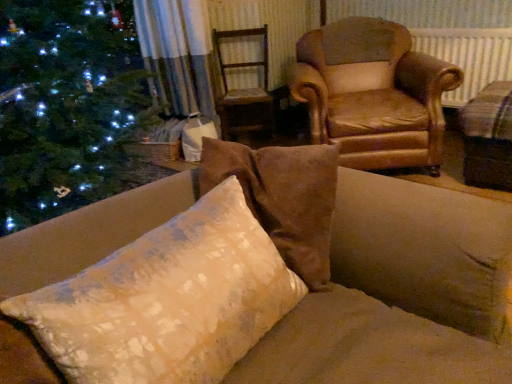
Locate an element on the screen. beige fabric cushion at right is located at coordinates (488, 137).

Which of these two, white plastic radiator at upper right or textured cream pillow at center, is smaller?

With smaller size is white plastic radiator at upper right.

Relative to textured cream pillow at center, is white plastic radiator at upper right in front or behind?

white plastic radiator at upper right is behind textured cream pillow at center.

From the picture: From the image's perspective, is white plastic radiator at upper right located above textured cream pillow at center?

Indeed, from the image's perspective, white plastic radiator at upper right is shown above textured cream pillow at center.

Who is bigger, white plastic radiator at upper right or leather armchair at upper right?

With larger size is leather armchair at upper right.

Measure the distance between white plastic radiator at upper right and leather armchair at upper right.

19.35 inches.

Considering the points (475, 39) and (345, 110), which point is in front, point (475, 39) or point (345, 110)?

Positioned in front is point (345, 110).

Is white plastic radiator at upper right with leather armchair at upper right?

No, white plastic radiator at upper right is not making contact with leather armchair at upper right.

How many degrees apart are the facing directions of wooden swivel chair at center and white plastic radiator at upper right?

41.5 degrees separate the facing orientations of wooden swivel chair at center and white plastic radiator at upper right.

Is wooden swivel chair at center taller than white plastic radiator at upper right?

Yes.

Considering the sizes of wooden swivel chair at center and white plastic radiator at upper right in the image, is wooden swivel chair at center wider or thinner than white plastic radiator at upper right?

Clearly, wooden swivel chair at center has more width compared to white plastic radiator at upper right.

From a real-world perspective, between wooden swivel chair at center and white plastic radiator at upper right, who is vertically higher?

From a 3D spatial view, white plastic radiator at upper right is above.

Does point (389, 109) lie in front of point (159, 313)?

No.

Is leather armchair at upper right positioned with its back to textured cream pillow at center?

leather armchair at upper right does not have its back to textured cream pillow at center.

What's the angular difference between leather armchair at upper right and textured cream pillow at center's facing directions?

The facing directions of leather armchair at upper right and textured cream pillow at center are 54.3 degrees apart.

Does leather armchair at upper right have a larger size compared to textured cream pillow at center?

Correct, leather armchair at upper right is larger in size than textured cream pillow at center.

Between textured cream pillow at center and leather armchair at upper right, which one is positioned in front?

textured cream pillow at center is closer to the camera.

Is textured cream pillow at center aimed at leather armchair at upper right?

No, textured cream pillow at center is not facing towards leather armchair at upper right.

In the scene shown: What's the angular difference between textured cream pillow at center and leather armchair at upper right's facing directions?

54.3 degrees.

Is textured cream pillow at center completely or partially outside of beige fabric cushion at right?

Absolutely, textured cream pillow at center is external to beige fabric cushion at right.

Can you confirm if textured cream pillow at center is taller than beige fabric cushion at right?

No, textured cream pillow at center is not taller than beige fabric cushion at right.

From the image's perspective, which is below, textured cream pillow at center or beige fabric cushion at right?

From the image's view, textured cream pillow at center is below.

Measure the distance from textured cream pillow at center to beige fabric cushion at right.

They are 1.84 meters apart.

Consider the image. From a real-world perspective, does white plastic radiator at upper right stand above wooden swivel chair at center?

A: Yes.

Is white plastic radiator at upper right inside or outside of wooden swivel chair at center?

white plastic radiator at upper right cannot be found inside wooden swivel chair at center.

From the image's perspective, which is above, white plastic radiator at upper right or wooden swivel chair at center?

white plastic radiator at upper right, from the image's perspective.

Between white plastic radiator at upper right and wooden swivel chair at center, which one has larger width?

wooden swivel chair at center.

Identify the location of radiator that is behind the textured cream pillow at center. (468, 56).

What are the coordinates of `radiator to the right of leather armchair at upper right` in the screenshot? It's located at (468, 56).

Based on their spatial positions, is textured cream pillow at center or leather armchair at upper right further from beige fabric cushion at right?

Among the two, textured cream pillow at center is located further to beige fabric cushion at right.

Based on their spatial positions, is beige fabric cushion at right or textured cream pillow at center closer to white plastic radiator at upper right?

beige fabric cushion at right.

Looking at the image, which one is located closer to beige fabric cushion at right, leather armchair at upper right or textured cream pillow at center?

leather armchair at upper right lies closer to beige fabric cushion at right than the other object.

Consider the image. Looking at the image, which one is located further to beige fabric cushion at right, textured cream pillow at center or white plastic radiator at upper right?

textured cream pillow at center lies further to beige fabric cushion at right than the other object.

Based on their spatial positions, is wooden swivel chair at center or white plastic radiator at upper right closer to leather armchair at upper right?

Based on the image, white plastic radiator at upper right appears to be nearer to leather armchair at upper right.

Which object lies further to the anchor point leather armchair at upper right, wooden swivel chair at center or beige fabric cushion at right?

wooden swivel chair at center lies further to leather armchair at upper right than the other object.

Which object lies further to the anchor point white plastic radiator at upper right, wooden swivel chair at center or beige fabric cushion at right?

wooden swivel chair at center is positioned further to the anchor white plastic radiator at upper right.

When comparing their distances from leather armchair at upper right, does beige fabric cushion at right or textured cream pillow at center seem further?

textured cream pillow at center is positioned further to the anchor leather armchair at upper right.

The width and height of the screenshot is (512, 384). Find the location of `beige between textured cream pillow at center and leather armchair at upper right in the front-back direction`. beige between textured cream pillow at center and leather armchair at upper right in the front-back direction is located at coordinates (488, 137).

Where is `chair located between textured cream pillow at center and wooden swivel chair at center in the depth direction`? This screenshot has height=384, width=512. chair located between textured cream pillow at center and wooden swivel chair at center in the depth direction is located at coordinates (373, 94).

The width and height of the screenshot is (512, 384). I want to click on radiator situated between leather armchair at upper right and beige fabric cushion at right from left to right, so click(x=468, y=56).

Where is `beige between textured cream pillow at center and white plastic radiator at upper right along the z-axis`? Image resolution: width=512 pixels, height=384 pixels. beige between textured cream pillow at center and white plastic radiator at upper right along the z-axis is located at coordinates (x=488, y=137).